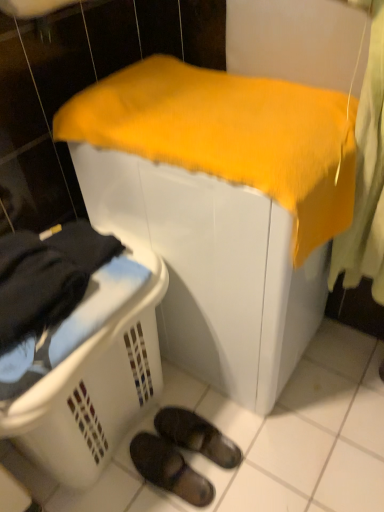
Question: Does black suede slippers at lower center, which is the second footwear from bottom to top, come behind yellow fabric-covered object at center?

Choices:
 (A) yes
 (B) no

Answer: (A)

Question: Does black suede slippers at lower center, which is counted as the first footwear, starting from the top, have a larger size compared to yellow fabric-covered object at center?

Choices:
 (A) yes
 (B) no

Answer: (B)

Question: Could you tell me if black suede slippers at lower center, which is counted as the first footwear, starting from the top, is turned towards yellow fabric-covered object at center?

Choices:
 (A) no
 (B) yes

Answer: (A)

Question: Is black suede slippers at lower center, which is counted as the first footwear, starting from the top, surrounding yellow fabric-covered object at center?

Choices:
 (A) yes
 (B) no

Answer: (B)

Question: Is black suede slippers at lower center, which is the second footwear from bottom to top, shorter than yellow fabric-covered object at center?

Choices:
 (A) yes
 (B) no

Answer: (A)

Question: Is black suede slippers at lower center, which is counted as the first footwear, starting from the top, at the right side of yellow fabric-covered object at center?

Choices:
 (A) no
 (B) yes

Answer: (A)

Question: From a real-world perspective, is black rubber slippers at lower center, the first footwear when ordered from bottom to top, below black suede slippers at lower center, which is counted as the first footwear, starting from the top?

Choices:
 (A) no
 (B) yes

Answer: (B)

Question: Are black rubber slippers at lower center, the second footwear from the top, and black suede slippers at lower center, which is the second footwear from bottom to top, beside each other?

Choices:
 (A) no
 (B) yes

Answer: (B)

Question: Is black rubber slippers at lower center, the second footwear from the top, closer to the viewer compared to black suede slippers at lower center, which is counted as the first footwear, starting from the top?

Choices:
 (A) no
 (B) yes

Answer: (B)

Question: From a real-world perspective, is black rubber slippers at lower center, the second footwear from the top, located higher than black suede slippers at lower center, which is counted as the first footwear, starting from the top?

Choices:
 (A) yes
 (B) no

Answer: (B)

Question: Can you confirm if black rubber slippers at lower center, the first footwear when ordered from bottom to top, is taller than black suede slippers at lower center, which is the second footwear from bottom to top?

Choices:
 (A) yes
 (B) no

Answer: (A)

Question: From the image's perspective, is black rubber slippers at lower center, the second footwear from the top, located above black suede slippers at lower center, which is counted as the first footwear, starting from the top?

Choices:
 (A) no
 (B) yes

Answer: (A)

Question: From the image's perspective, is white plastic laundry basket at lower left under yellow fabric-covered object at center?

Choices:
 (A) no
 (B) yes

Answer: (B)